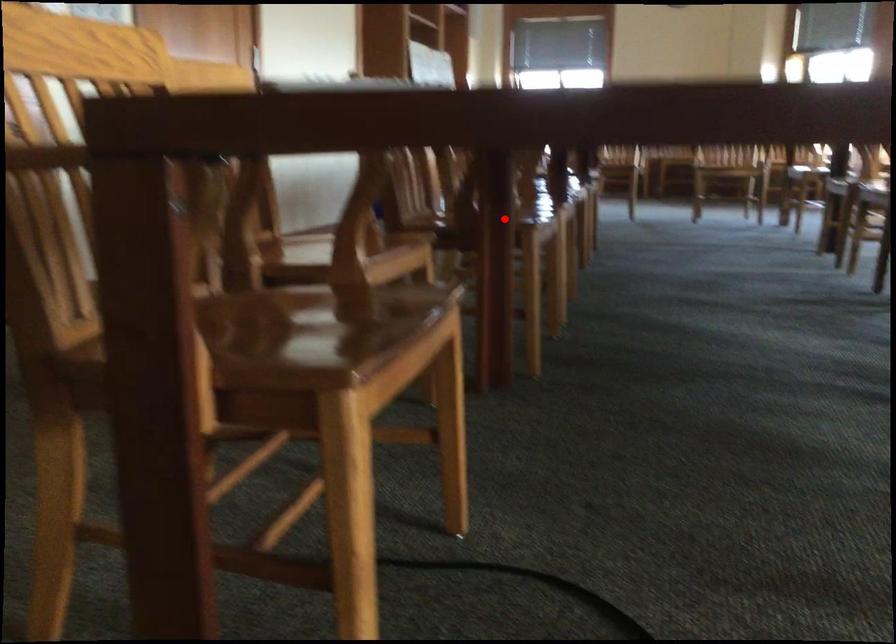
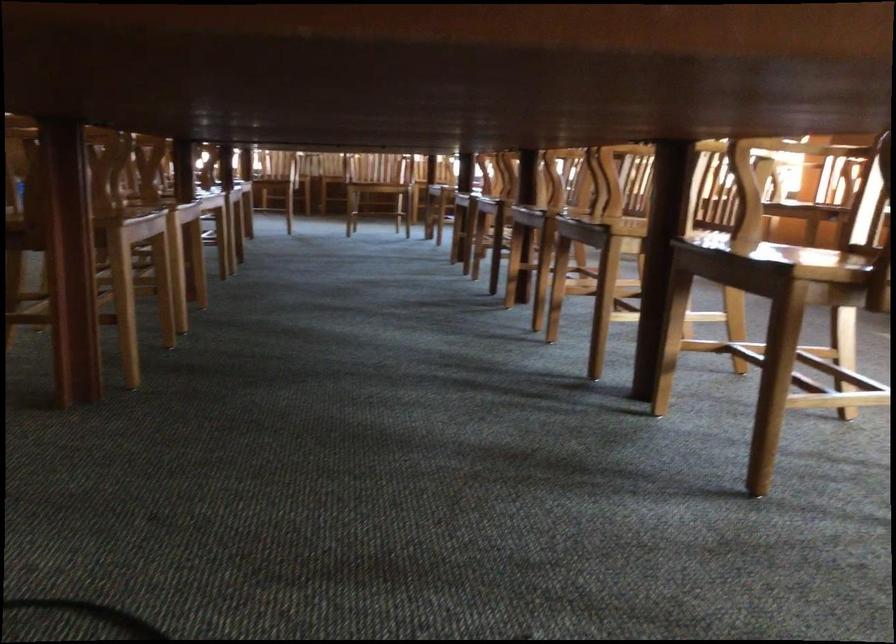
In the second image, find the point that corresponds to the highlighted location in the first image.

(80, 223)